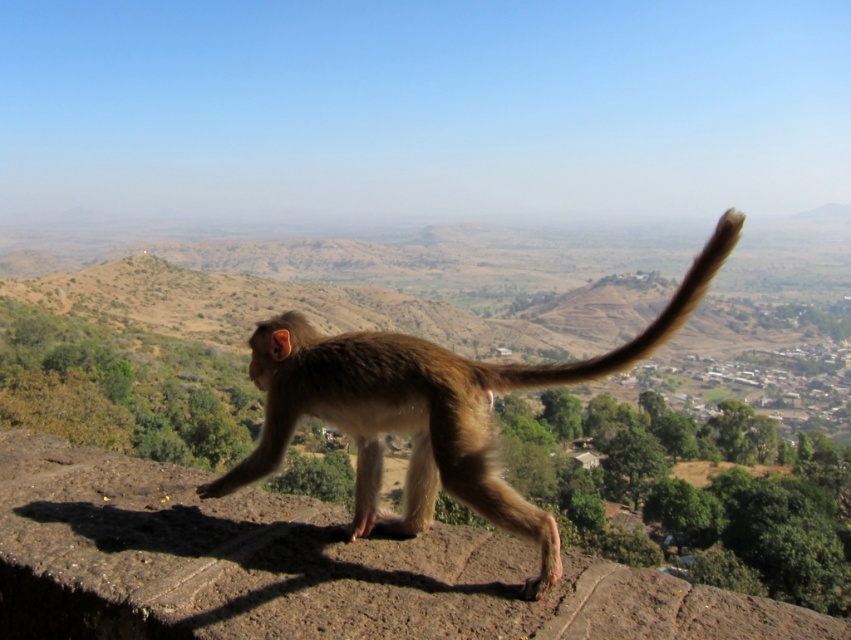
You are a wildlife photographer observing the scene. You notice the brown furry monkey at center and the brown furry tail at center. Which object is positioned further to the right?

The brown furry tail at center is positioned further to the right than the brown furry monkey at center.

You are an observer watching the monkey walk along the stone wall. Which part of the monkey, the brown furry monkey at center or the brown furry tail at center, is positioned closer to you?

The brown furry monkey at center is positioned closer to you because the brown furry tail at center is behind it.

You are a wildlife photographer aiming to capture the monkey in the image. If your camera has a focus range of 1 meter, can you focus on both the brown furry monkey at center and the brown furry tail at center simultaneously?

The brown furry monkey at center and brown furry tail at center are 1.27 meters apart. Since the camera can only focus within a 1 meter range, it cannot focus on both simultaneously because the distance between them exceeds the focus range.